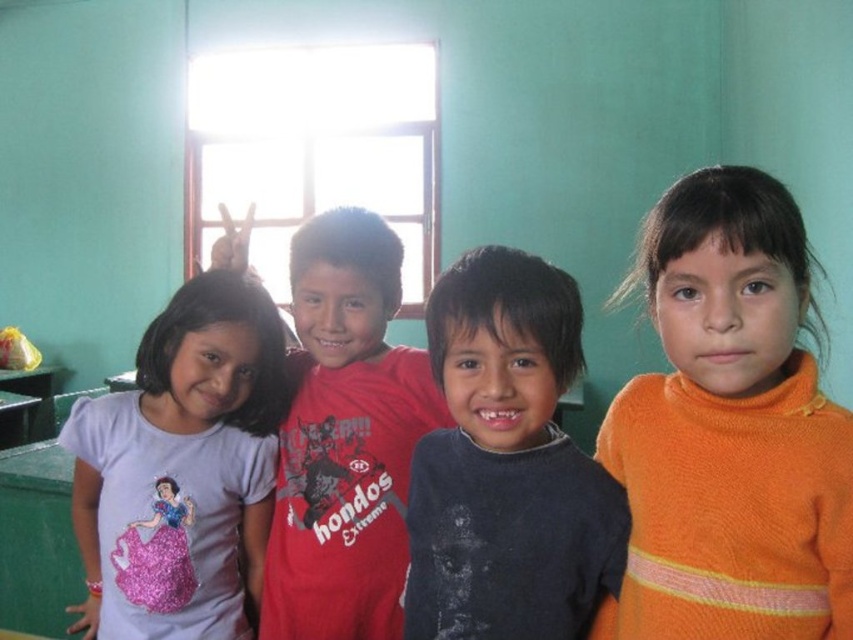
Question: Is purple cotton shirt at left wider than red matte shirt at center?

Choices:
 (A) yes
 (B) no

Answer: (B)

Question: Which point appears farthest from the camera in this image?

Choices:
 (A) (267, 321)
 (B) (339, 211)
 (C) (561, 444)

Answer: (A)

Question: Considering the relative positions of purple cotton shirt at left and red matte shirt at center in the image provided, where is purple cotton shirt at left located with respect to red matte shirt at center?

Choices:
 (A) above
 (B) below

Answer: (B)

Question: Is orange knitted sweater at right to the left of red matte shirt at center from the viewer's perspective?

Choices:
 (A) yes
 (B) no

Answer: (B)

Question: Which point is closer to the camera taking this photo?

Choices:
 (A) (186, 358)
 (B) (755, 198)
 (C) (500, 436)
 (D) (350, 492)

Answer: (B)

Question: Which of the following is the farthest from the observer?

Choices:
 (A) (666, 332)
 (B) (322, 538)
 (C) (614, 486)
 (D) (202, 291)

Answer: (D)